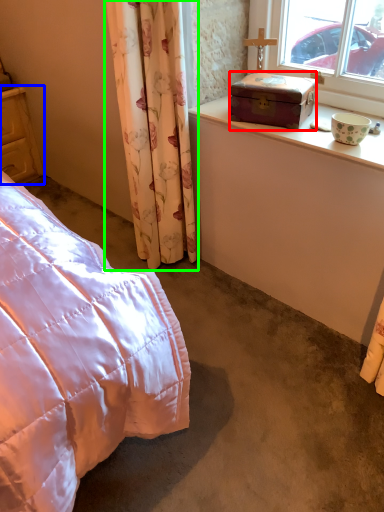
Question: Which object is the closest to the box (highlighted by a red box)? Choose among these: cupboard (highlighted by a blue box) or curtain (highlighted by a green box).

Choices:
 (A) cupboard
 (B) curtain

Answer: (B)